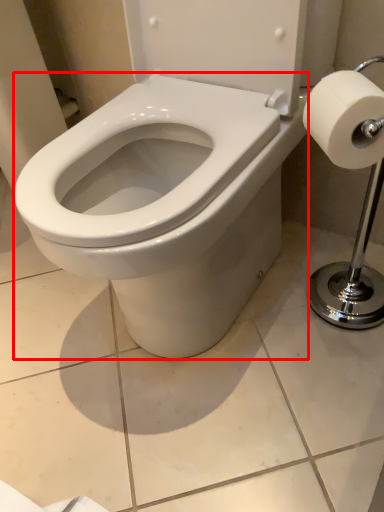
Question: From the image's perspective, what is the correct spatial relationship of bidet (annotated by the red box) in relation to toilet paper?

Choices:
 (A) above
 (B) below

Answer: (B)